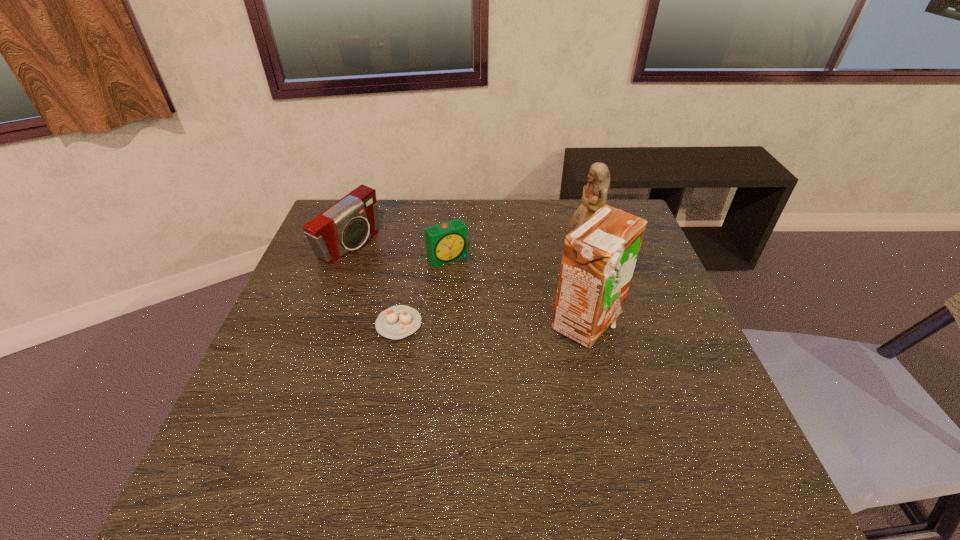
Where is `vacant space that satisfies the following two spatial constraints: 1. on the back side of the figurine; 2. on the left side of the cupcake`? The width and height of the screenshot is (960, 540). vacant space that satisfies the following two spatial constraints: 1. on the back side of the figurine; 2. on the left side of the cupcake is located at coordinates (413, 250).